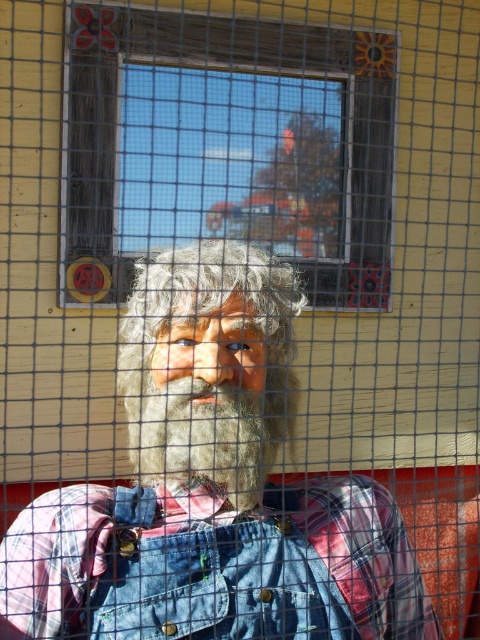
Is clear glass window at center above fuzzy brown beard at center?

Yes.

Is clear glass window at center closer to camera compared to fuzzy brown beard at center?

No, it is not.

Locate an element on the screen. clear glass window at center is located at coordinates (227, 147).